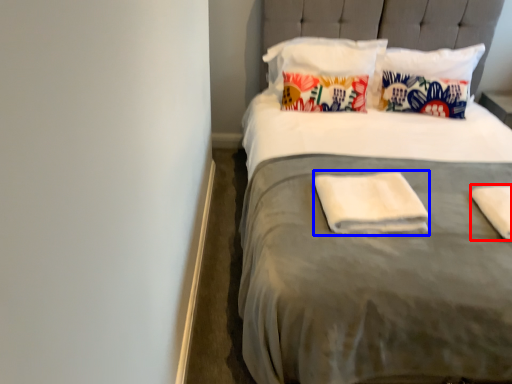
Question: Which object is further to the camera taking this photo, material (highlighted by a red box) or material (highlighted by a blue box)?

Choices:
 (A) material
 (B) material

Answer: (B)